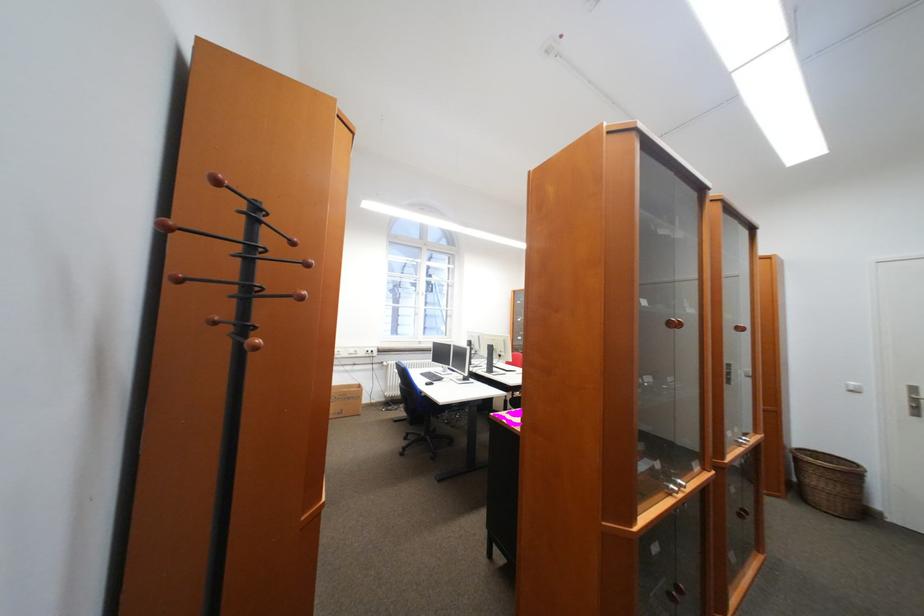
Where is `wicker basket`? This screenshot has height=616, width=924. wicker basket is located at coordinates (830, 483).